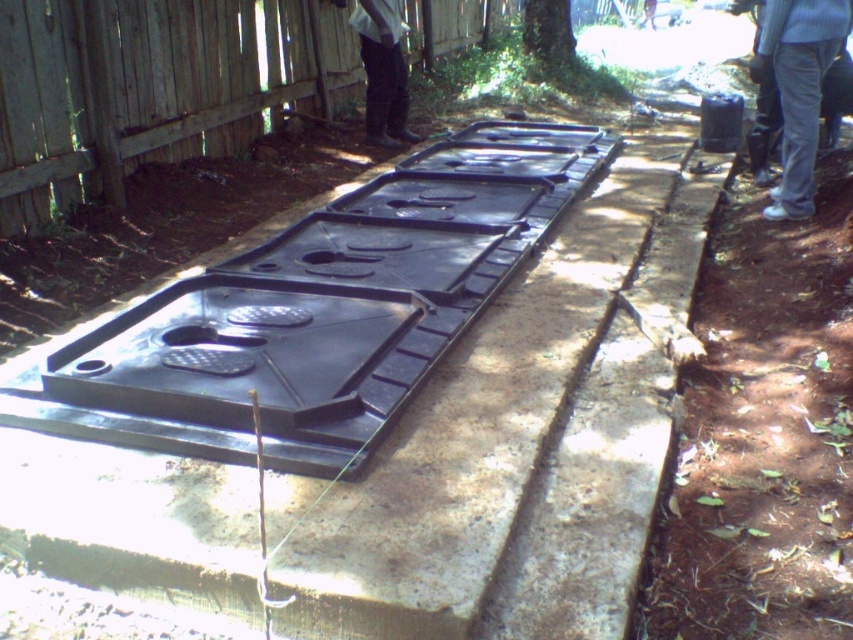
You are a construction worker inspecting the components on the concrete surface. You notice the black plastic tank at center and the white fabric pants at center. Which object is bigger in size?

The black plastic tank at center has a larger size compared to the white fabric pants at center, so the black plastic tank at center is bigger.

You are a worker at the construction site. You need to place a new component between the wooden fence at upper left and the gray cotton pants at lower right. Which object should you place the component closer to, the wooden fence or the gray cotton pants?

The wooden fence at upper left is positioned under gray cotton pants at lower right, so you should place the component closer to the gray cotton pants at lower right since it is above the wooden fence.

You are standing in an outdoor area with construction components. You notice the wooden fence at upper left and the gray cotton pants at lower right. Which object is narrower?

The wooden fence at upper left is narrower than the gray cotton pants at lower right.